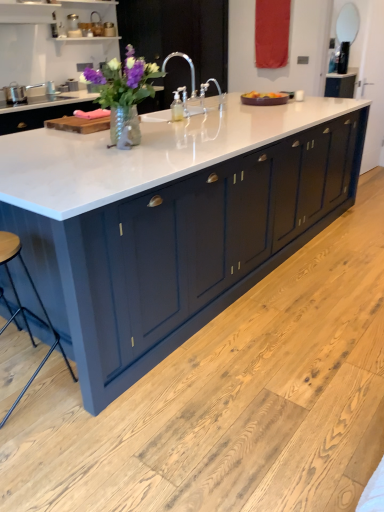
The width and height of the screenshot is (384, 512). What are the coordinates of `vacant space to the right of matte glass vase at center` in the screenshot? It's located at (196, 146).